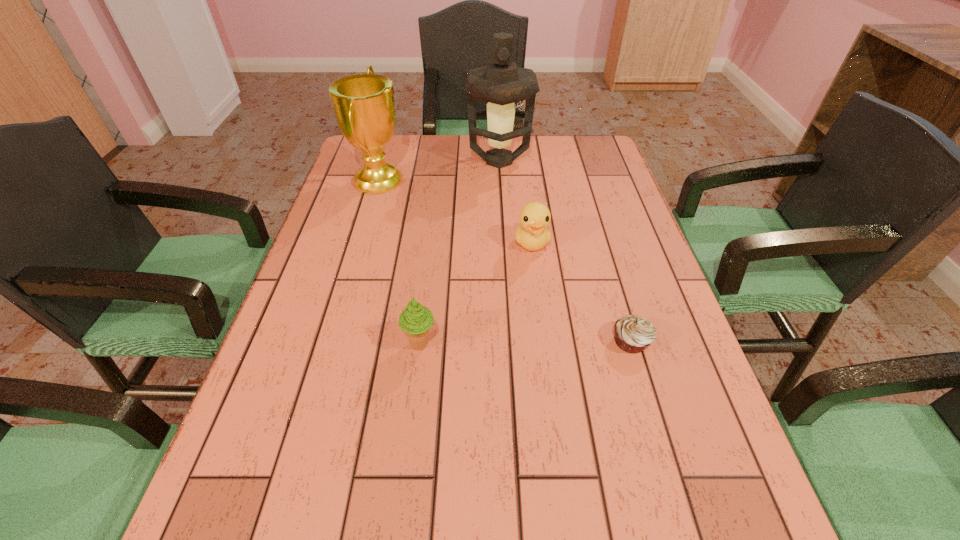
Identify the location of vacant area that lies between the duck and the oil lamp. The width and height of the screenshot is (960, 540). (516, 202).

Locate an element on the screen. Image resolution: width=960 pixels, height=540 pixels. the closest object to the oil lamp is located at coordinates (363, 104).

Choose which object is the nearest neighbor to the oil lamp. Please provide its 2D coordinates. Your answer should be formatted as a tuple, i.e. [(x, y)], where the tuple contains the x and y coordinates of a point satisfying the conditions above.

[(363, 104)]

The height and width of the screenshot is (540, 960). Find the location of `free space in the image that satisfies the following two spatial constraints: 1. on the front side of the rightmost object; 2. on the left side of the oil lamp`. free space in the image that satisfies the following two spatial constraints: 1. on the front side of the rightmost object; 2. on the left side of the oil lamp is located at coordinates (510, 341).

Find the location of a particular element. vacant space that satisfies the following two spatial constraints: 1. on the shiny surface of the icecream; 2. on the left side of the fourth shortest object is located at coordinates (x=329, y=345).

What are the coordinates of `free space that satisfies the following two spatial constraints: 1. on the shiny surface of the second object from left to right; 2. on the left side of the fourth shortest object` in the screenshot? It's located at (329, 345).

This screenshot has width=960, height=540. Find the location of `vacant region that satisfies the following two spatial constraints: 1. on the face of the rightmost object; 2. on the right side of the third nearest object`. vacant region that satisfies the following two spatial constraints: 1. on the face of the rightmost object; 2. on the right side of the third nearest object is located at coordinates (544, 341).